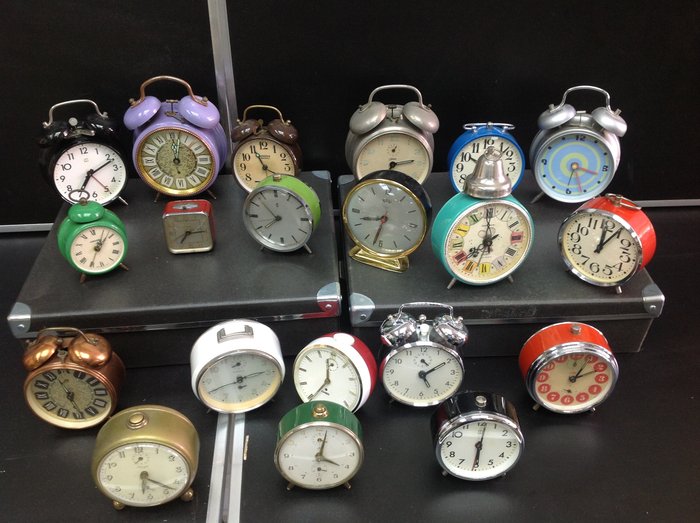
Where is `green clock`? green clock is located at coordinates (288, 187), (83, 221), (323, 413).